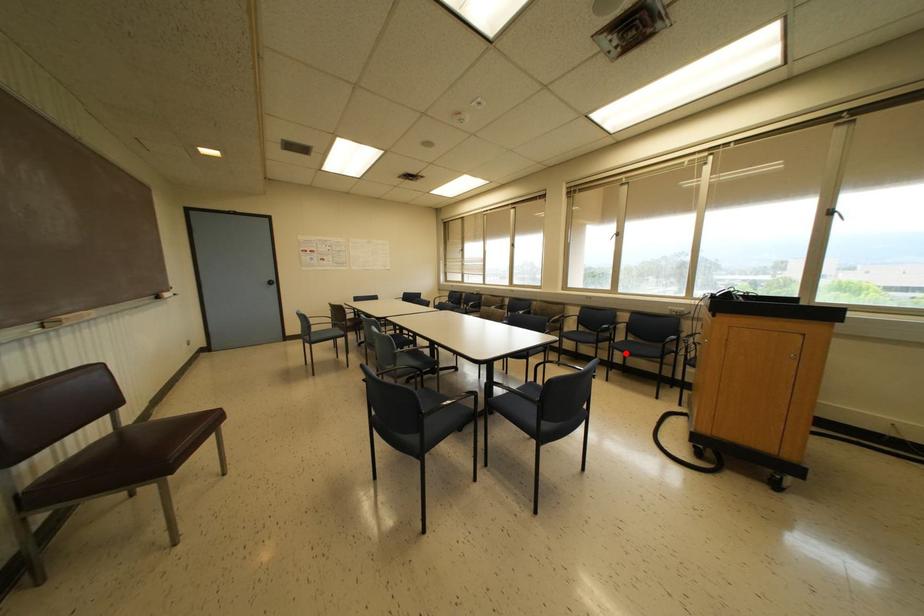
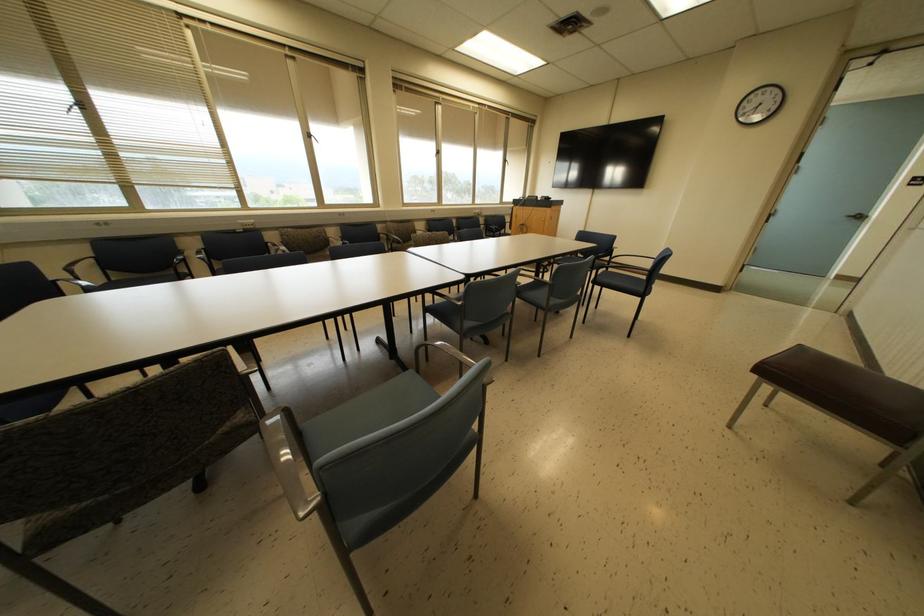
Question: I am providing you with two images of the same scene from different viewpoints. A red point is marked on the first image. Can you still see the location of the red point in image 2?

Choices:
 (A) Yes
 (B) No

Answer: (B)